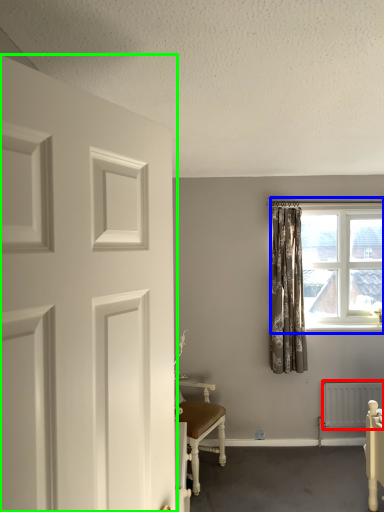
Question: Which object is the farthest from radiator (highlighted by a red box)? Choose among these: window (highlighted by a blue box) or door (highlighted by a green box).

Choices:
 (A) window
 (B) door

Answer: (B)